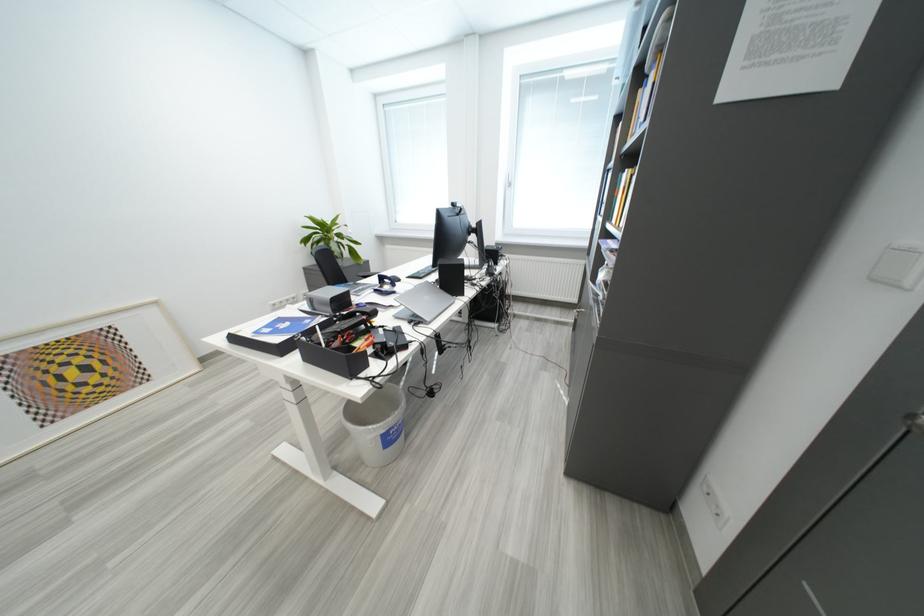
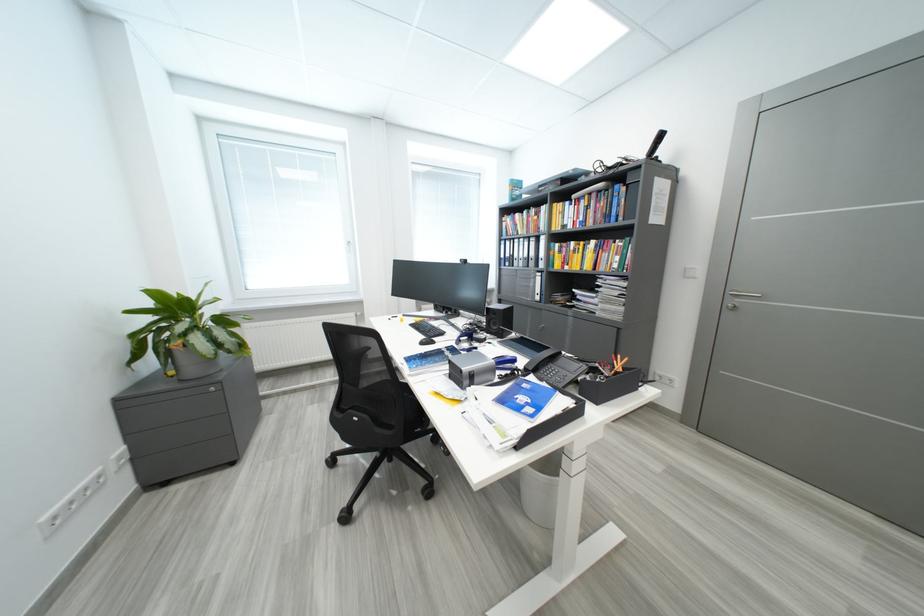
Locate, in the second image, the point that corresponds to the point at 324,241 in the first image.

(189, 331)